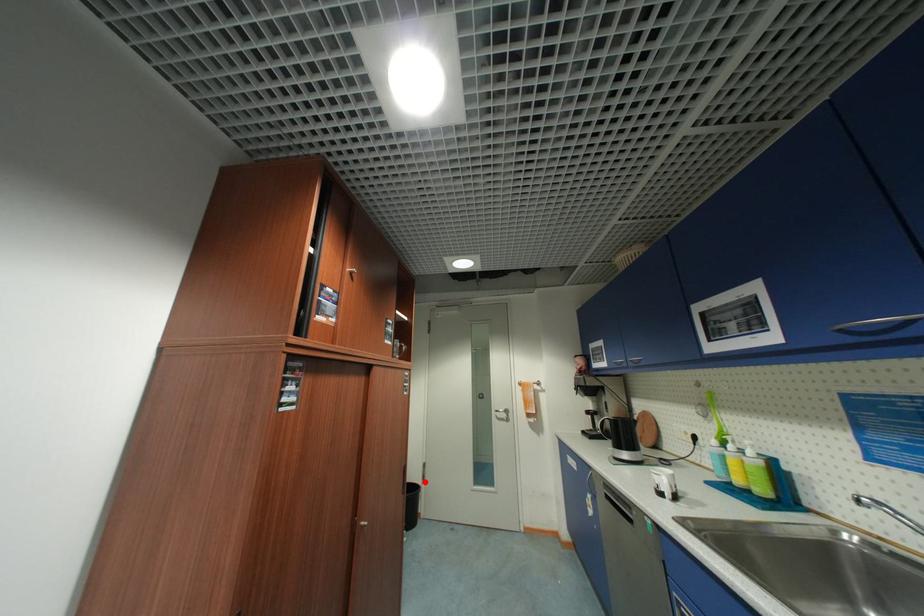
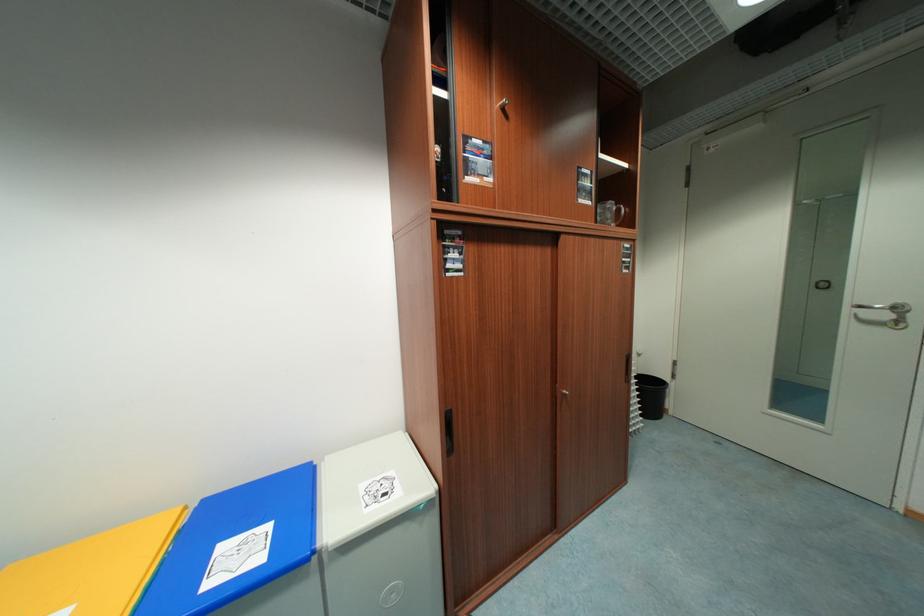
Where in the second image is the point corresponding to the highlighted location from the first image?

(672, 379)